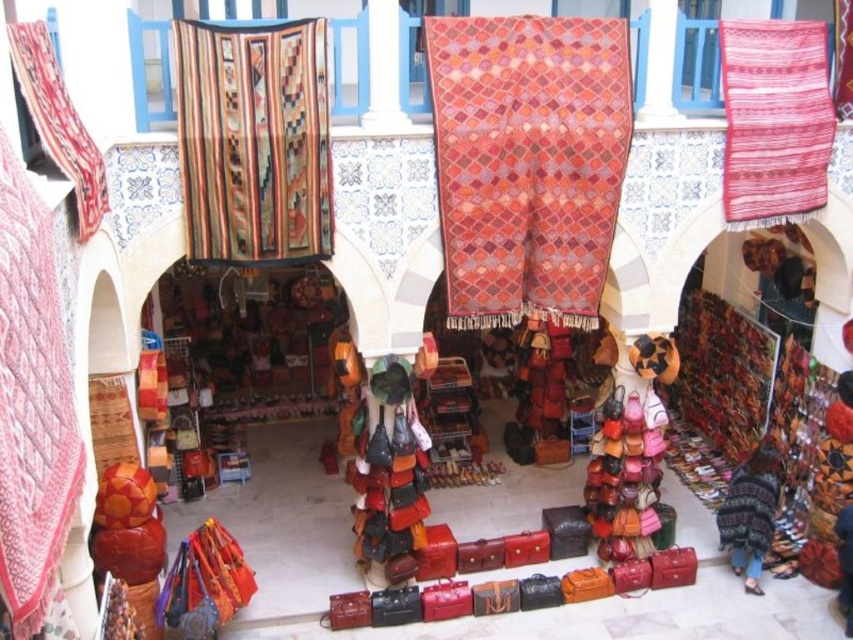
You are a customer at the market and want to place a small decorative item on the nearest rug. Which rug should you choose between the multicolored woven rug at upper left and the woven fabric rug at upper right?

The multicolored woven rug at upper left is much taller than the woven fabric rug at upper right, so you should choose the multicolored woven rug at upper left as it is taller and likely provides a more stable surface for placing the decorative item.

You are navigating a vibrant market scene with arches and tilework in the background. You see a textured woolen rug at center. Can you determine its exact position using the coordinate system provided?

The textured woolen rug at center is located at point [527,161].